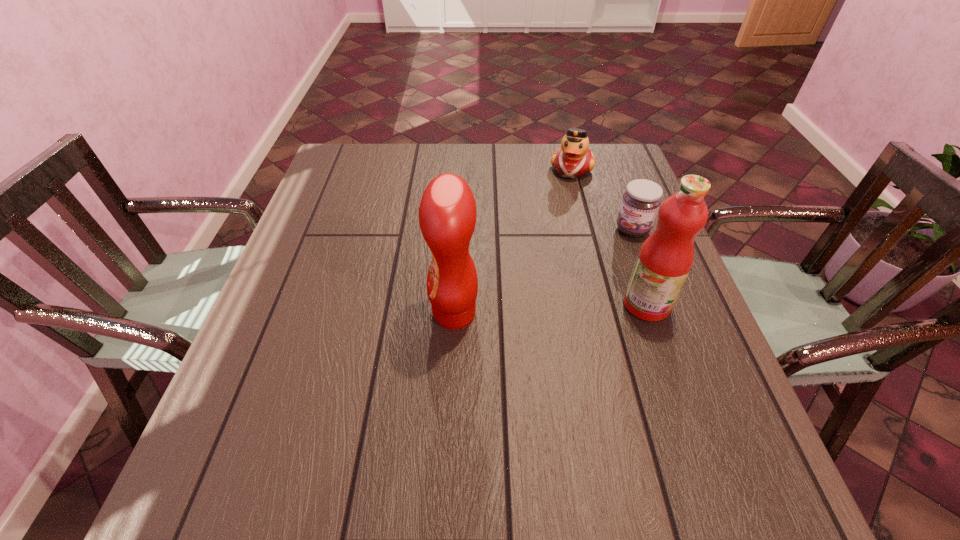
At what (x,y) coordinates should I click in order to perform the action: click on free space located on the face of the farthest object. Please return your answer as a coordinate pair (x, y). The image size is (960, 540). Looking at the image, I should click on (557, 234).

I want to click on free space located 0.150m on the face of the farthest object, so click(x=563, y=213).

Image resolution: width=960 pixels, height=540 pixels. Find the location of `vacant space located on the face of the farthest object`. vacant space located on the face of the farthest object is located at coordinates (548, 272).

Locate an element on the screen. This screenshot has width=960, height=540. object that is at the far edge is located at coordinates (573, 159).

Identify the location of fruit juice that is positioned at the right edge. The image size is (960, 540). (665, 259).

You are a GUI agent. You are given a task and a screenshot of the screen. Output one action in this format:
    pyautogui.click(x=<x>, y=<y>)
    Task: Click on the jam situated at the right edge
    The width and height of the screenshot is (960, 540).
    Given the screenshot: What is the action you would take?
    pyautogui.click(x=640, y=203)

Where is `duck present at the right edge`? Image resolution: width=960 pixels, height=540 pixels. duck present at the right edge is located at coordinates (573, 159).

You are a GUI agent. You are given a task and a screenshot of the screen. Output one action in this format:
    pyautogui.click(x=<x>, y=<y>)
    Task: Click on the object that is at the far right corner
    This screenshot has width=960, height=540.
    Given the screenshot: What is the action you would take?
    pyautogui.click(x=573, y=159)

Locate an element on the screen. vacant space at the far edge is located at coordinates (546, 157).

Where is `free space at the left edge`? Image resolution: width=960 pixels, height=540 pixels. free space at the left edge is located at coordinates (362, 229).